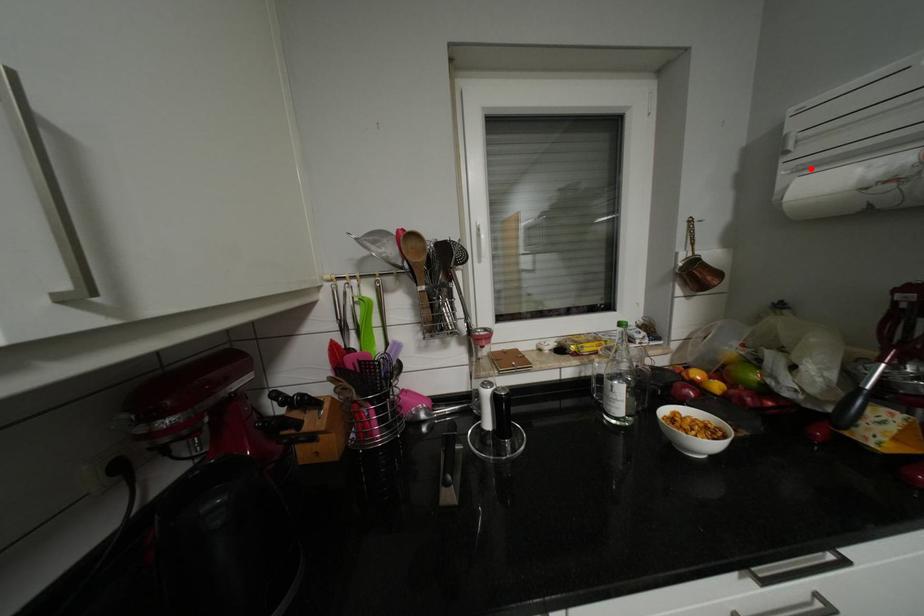
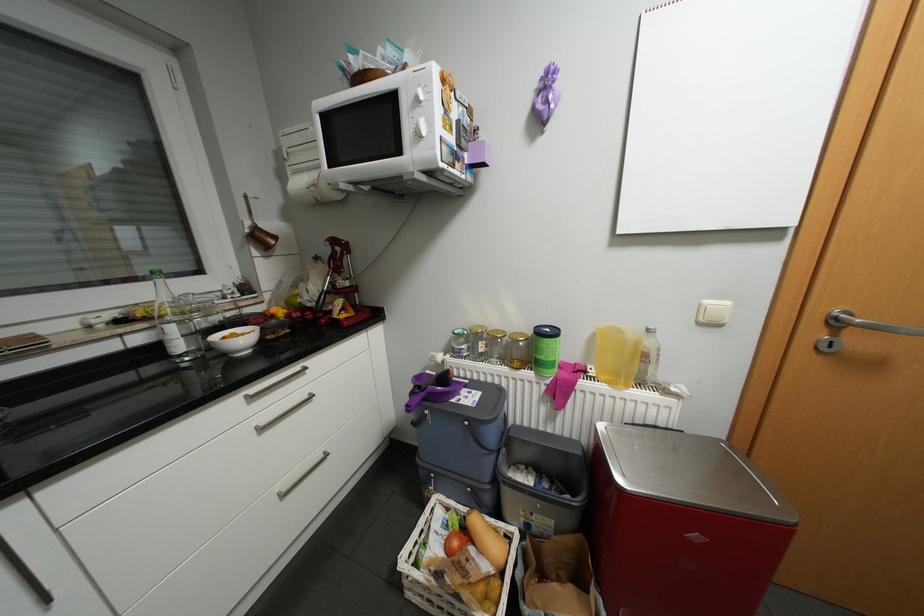
In the second image, find the point that corresponds to the highlighted location in the first image.

(302, 172)